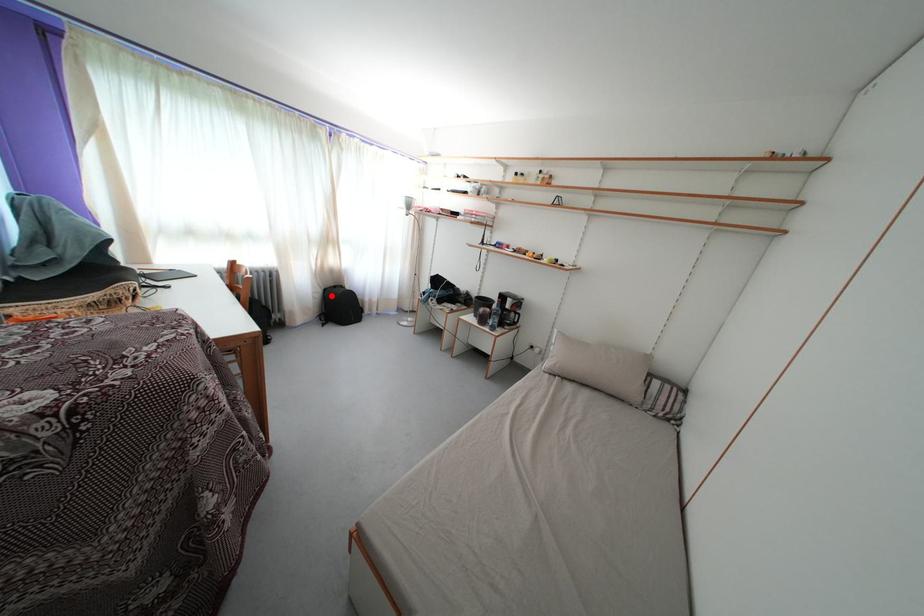
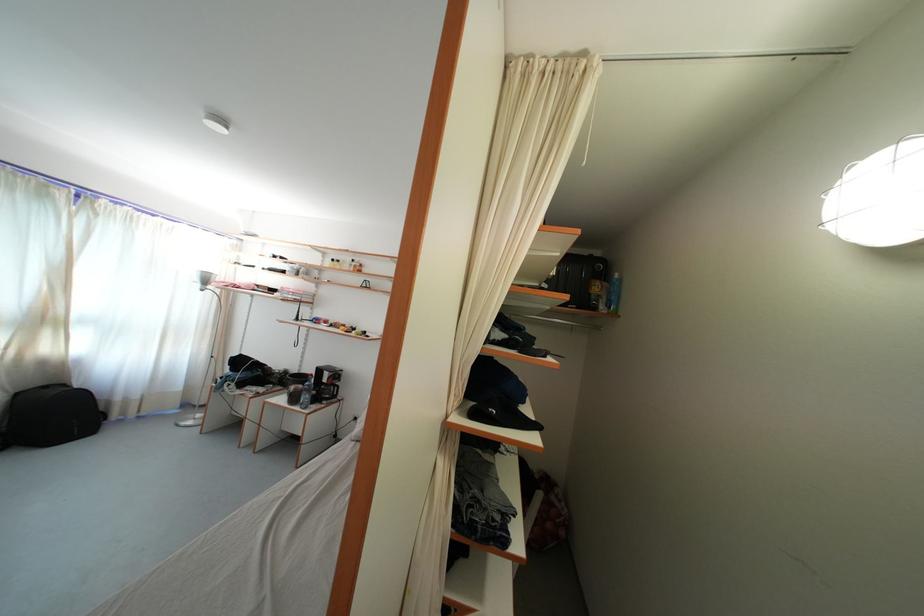
Question: I am providing you with two images of the same scene from different viewpoints. In image1, a red point is highlighted. Considering the same 3D point in image2, which of the following is correct?

Choices:
 (A) It is closer
 (B) It is farther

Answer: (B)